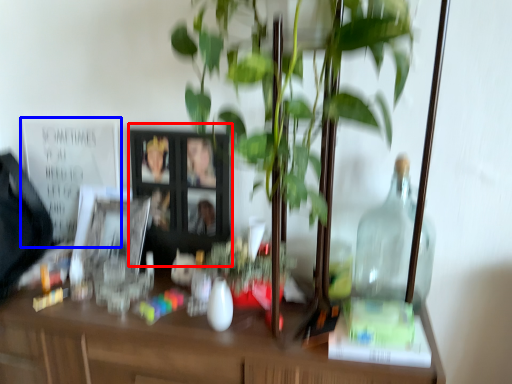
Question: Which of the following is the farthest to the observer, picture frame (highlighted by a red box) or bulletin board (highlighted by a blue box)?

Choices:
 (A) picture frame
 (B) bulletin board

Answer: (B)